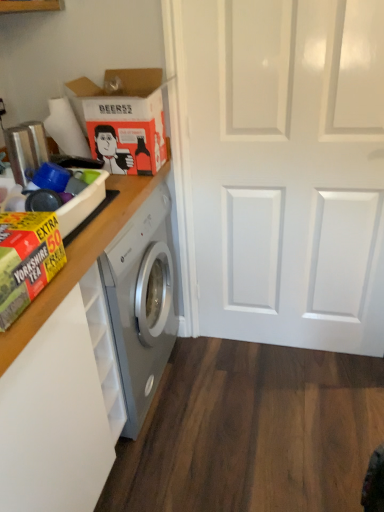
Identify the location of vacant space in front of white glossy door at center. (297, 411).